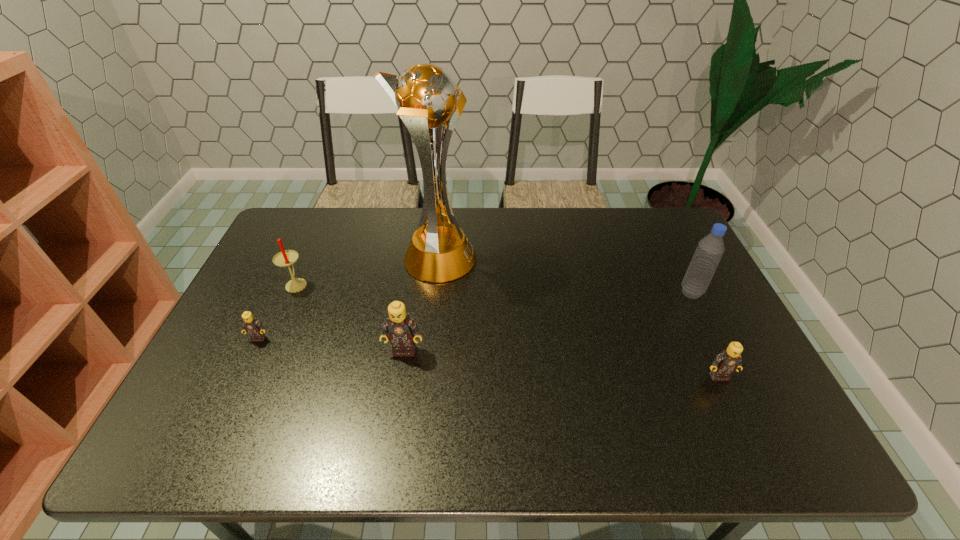
This screenshot has width=960, height=540. In order to click on the farthest Lego in this screenshot , I will do `click(250, 325)`.

Find the location of a particular element. This screenshot has height=540, width=960. the leftmost Lego is located at coordinates (250, 325).

Identify the location of the second Lego from right to left. The height and width of the screenshot is (540, 960). (401, 328).

At what (x,y) coordinates should I click in order to perform the action: click on the tallest Lego. Please return your answer as a coordinate pair (x, y). The height and width of the screenshot is (540, 960). Looking at the image, I should click on (401, 328).

This screenshot has height=540, width=960. Identify the location of the second shortest Lego. (728, 361).

Where is `the second shortest object`? The height and width of the screenshot is (540, 960). the second shortest object is located at coordinates (728, 361).

Where is `trophy`? The image size is (960, 540). trophy is located at coordinates (429, 102).

Where is `candle`? The height and width of the screenshot is (540, 960). candle is located at coordinates (284, 258).

Locate an element on the screen. The height and width of the screenshot is (540, 960). bottle is located at coordinates (710, 249).

The width and height of the screenshot is (960, 540). Find the location of `vacant space located in front of the shortest Lego`. vacant space located in front of the shortest Lego is located at coordinates (237, 383).